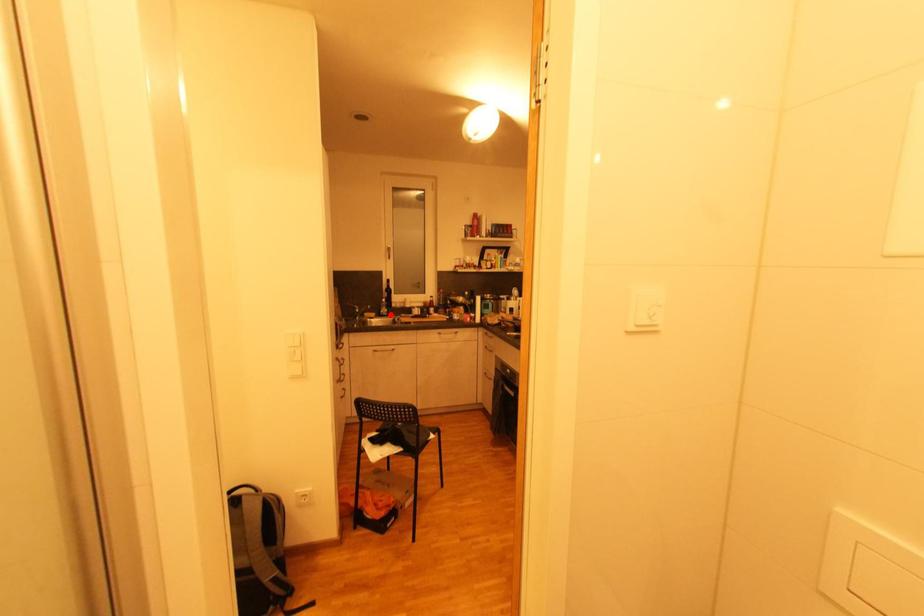
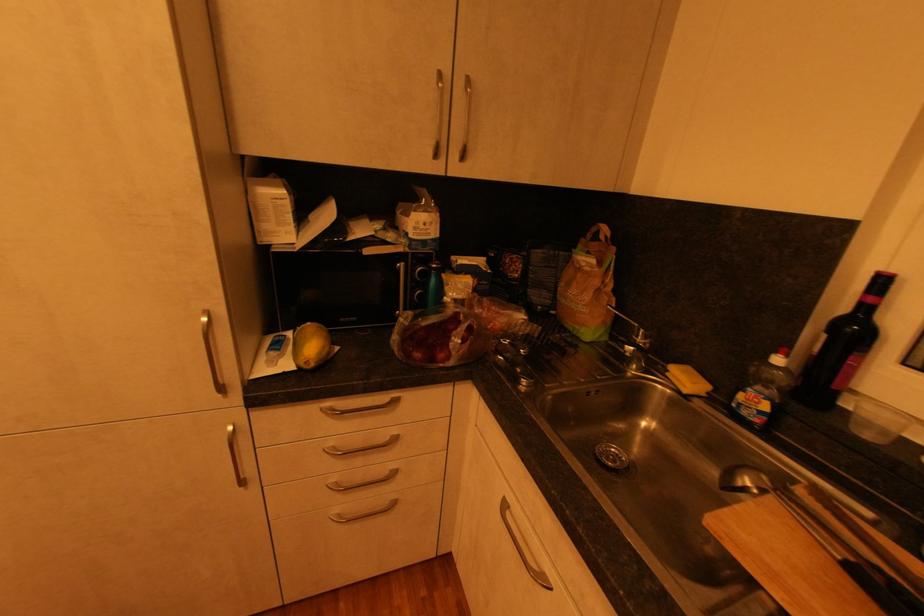
The point at the highlighted location is marked in the first image. Where is the corresponding point in the second image?

(760, 419)